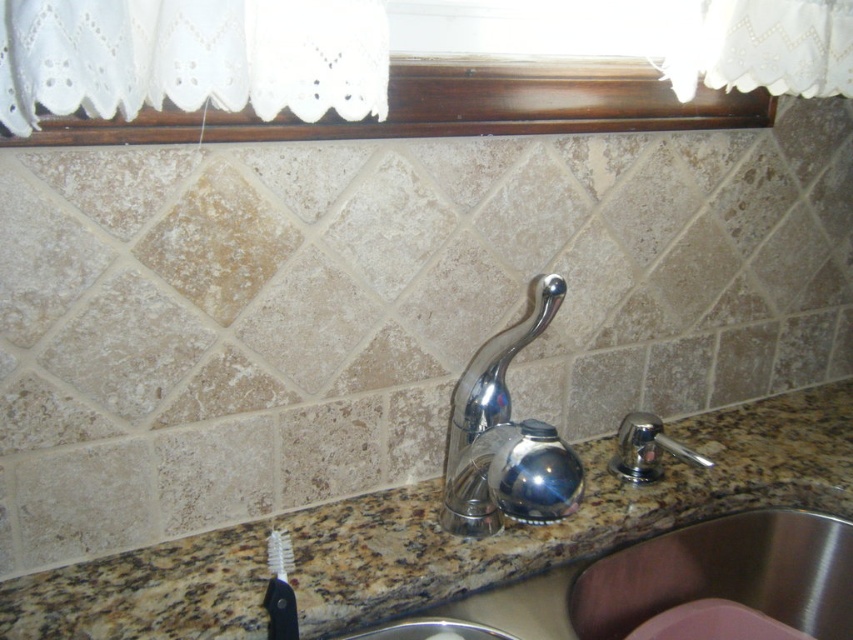
Question: Among these objects, which one is nearest to the camera?

Choices:
 (A) polished chrome faucet at right
 (B) stainless steel sink at lower right
 (C) granite at center
 (D) polished chrome faucet at center

Answer: (C)

Question: Can you confirm if granite at center is thinner than stainless steel sink at lower right?

Choices:
 (A) yes
 (B) no

Answer: (B)

Question: Is granite at center wider than white bristle toothbrush at lower left?

Choices:
 (A) no
 (B) yes

Answer: (B)

Question: Which is farther from the stainless steel sink at lower right?

Choices:
 (A) granite at center
 (B) dark wood window sill at upper center

Answer: (B)

Question: From the image, what is the correct spatial relationship of polished chrome faucet at center in relation to white bristle toothbrush at lower left?

Choices:
 (A) above
 (B) below

Answer: (A)

Question: Based on their relative distances, which object is nearer to the white bristle toothbrush at lower left?

Choices:
 (A) granite at center
 (B) polished chrome faucet at center
 (C) stainless steel sink at lower right

Answer: (B)